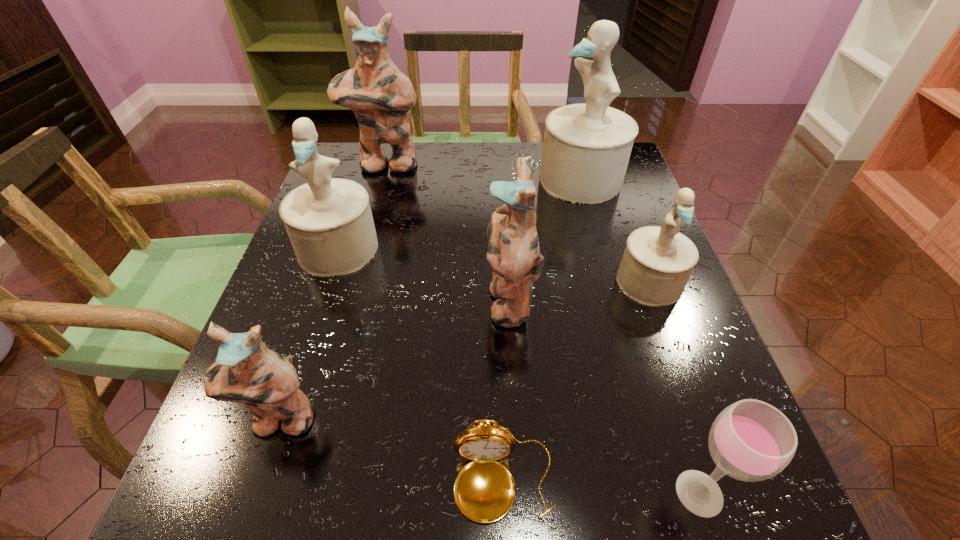
Where is `free space at the far left corner of the desktop`? Image resolution: width=960 pixels, height=540 pixels. free space at the far left corner of the desktop is located at coordinates (332, 158).

In the image, there is a desktop. Where is `vacant area at the near left corner`? Image resolution: width=960 pixels, height=540 pixels. vacant area at the near left corner is located at coordinates (279, 470).

This screenshot has width=960, height=540. In the image, there is a desktop. Identify the location of vacant space at the far right corner. click(627, 178).

In order to click on free space between the biggest white figurine and the wineglass in this screenshot , I will do `click(640, 336)`.

This screenshot has height=540, width=960. I want to click on free space between the second biggest white figurine and the nearest figurine, so click(309, 334).

Where is `blank region between the shortest object and the second smallest white figurine`? This screenshot has height=540, width=960. blank region between the shortest object and the second smallest white figurine is located at coordinates (421, 365).

Where is `vacant space in between the smallest white figurine and the wineglass`? vacant space in between the smallest white figurine and the wineglass is located at coordinates (674, 387).

Identify the location of vacant region between the nearest figurine and the pocket watch. (392, 451).

Where is `empty location between the second biggest white figurine and the wineglass`? The image size is (960, 540). empty location between the second biggest white figurine and the wineglass is located at coordinates (518, 370).

This screenshot has height=540, width=960. In order to click on free space between the second nearest pink figurine and the pocket watch in this screenshot , I will do `click(507, 391)`.